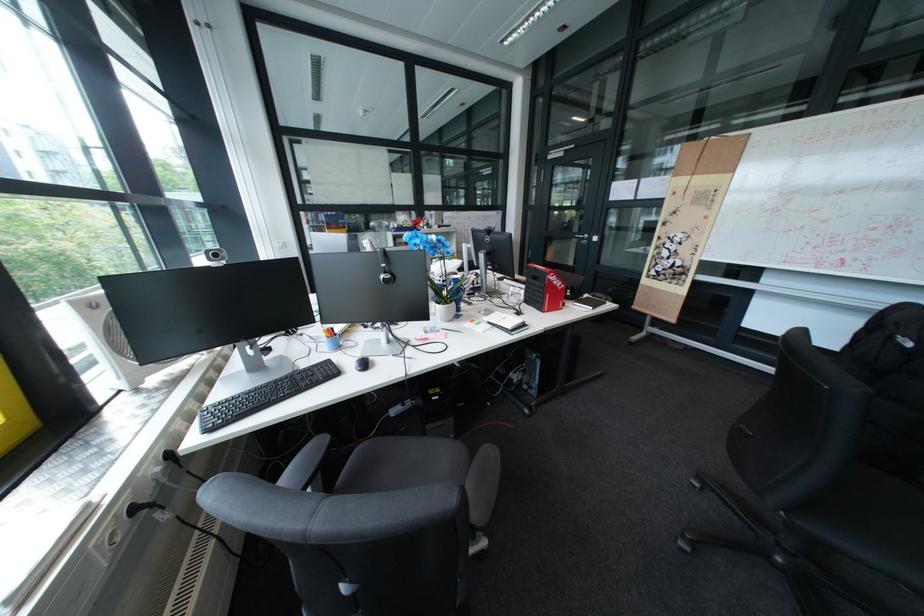
Find the location of `small black notebook`. small black notebook is located at coordinates (505, 322).